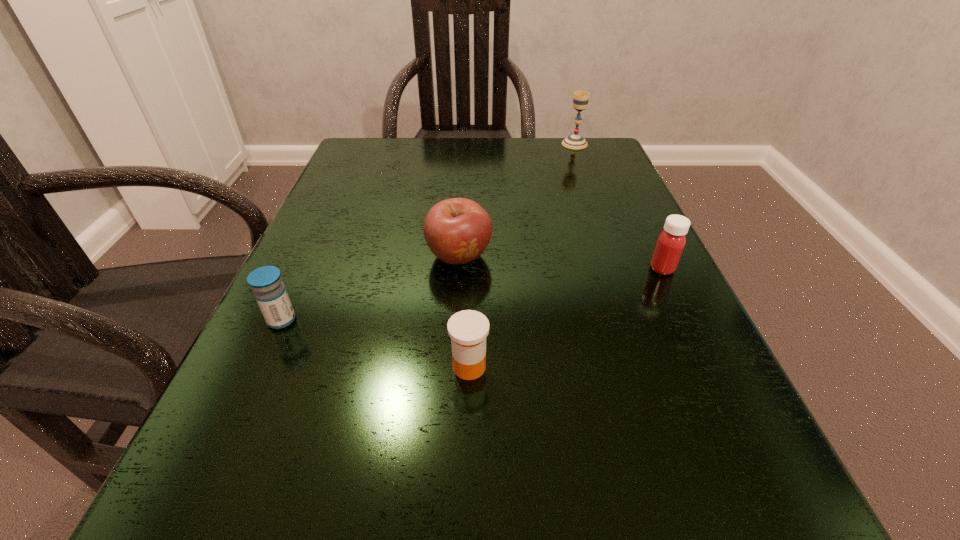
In the image, there is a desktop. In order to click on vacant space at the left edge in this screenshot , I will do `click(290, 271)`.

You are a GUI agent. You are given a task and a screenshot of the screen. Output one action in this format:
    pyautogui.click(x=<x>, y=<y>)
    Task: Click on the free space at the right edge of the desktop
    The image size is (960, 540).
    Given the screenshot: What is the action you would take?
    pyautogui.click(x=666, y=326)

In the image, there is a desktop. Where is `vacant region at the far left corner`? vacant region at the far left corner is located at coordinates (393, 157).

Locate an element on the screen. The height and width of the screenshot is (540, 960). vacant position at the far right corner of the desktop is located at coordinates (595, 164).

The width and height of the screenshot is (960, 540). I want to click on blank region between the apple and the farthest medicine, so click(x=561, y=262).

This screenshot has height=540, width=960. I want to click on empty space that is in between the fourth object from left to right and the nearest medicine, so click(522, 255).

Find the location of a particular element. This screenshot has height=540, width=960. free spot between the nearest medicine and the chalice is located at coordinates (522, 255).

Identify the location of unoccupied area between the nearest object and the second nearest medicine. Image resolution: width=960 pixels, height=540 pixels. (375, 343).

At what (x,y) coordinates should I click in order to perform the action: click on free space between the apple and the fourth farthest object. Please return your answer as a coordinate pair (x, y). The height and width of the screenshot is (540, 960). Looking at the image, I should click on (371, 288).

Locate an element on the screen. Image resolution: width=960 pixels, height=540 pixels. free space between the apple and the chalice is located at coordinates (517, 200).